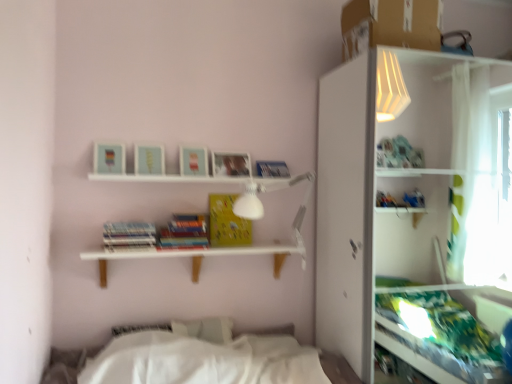
Image resolution: width=512 pixels, height=384 pixels. I want to click on free spot above hardcover book at center, arranged as the 2th paperback book when viewed from the left (from a real-world perspective), so click(179, 231).